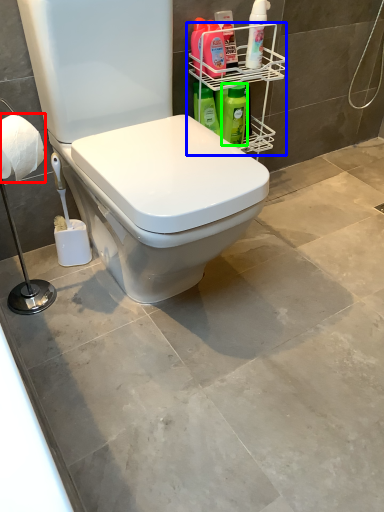
Question: Based on their relative distances, which object is farther from toilet paper (highlighted by a red box)? Choose from shelf (highlighted by a blue box) and cleaning product (highlighted by a green box).

Choices:
 (A) shelf
 (B) cleaning product

Answer: (A)